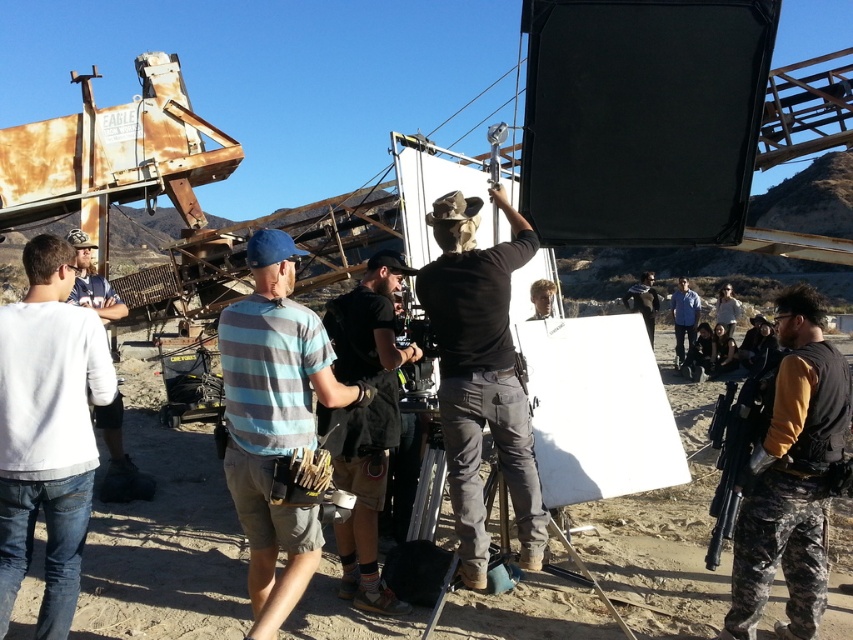
Is black matte shirt at center to the left of black matte gun at right from the viewer's perspective?

Indeed, black matte shirt at center is positioned on the left side of black matte gun at right.

Which is behind, point (463, 380) or point (722, 422)?

The point (722, 422) is more distant.

Does point (445, 248) come in front of point (714, 534)?

No, (445, 248) is behind (714, 534).

Locate an element on the screen. The width and height of the screenshot is (853, 640). black matte shirt at center is located at coordinates (480, 374).

In the scene shown: Who is lower down, white cotton shirt at left or black matte gun at right?

white cotton shirt at left is lower down.

Who is shorter, white cotton shirt at left or black matte gun at right?

black matte gun at right

Does point (78, 540) come closer to viewer compared to point (740, 460)?

Yes, point (78, 540) is closer to viewer.

You are a GUI agent. You are given a task and a screenshot of the screen. Output one action in this format:
    pyautogui.click(x=<x>, y=<y>)
    Task: Click on the white cotton shirt at left
    
    Given the screenshot: What is the action you would take?
    click(x=47, y=429)

Which of these two, striped cotton shirt at center or white matte shirt at left, stands shorter?

With less height is white matte shirt at left.

What do you see at coordinates (274, 420) in the screenshot? I see `striped cotton shirt at center` at bounding box center [274, 420].

Where is `striped cotton shirt at center`? Image resolution: width=853 pixels, height=640 pixels. striped cotton shirt at center is located at coordinates (274, 420).